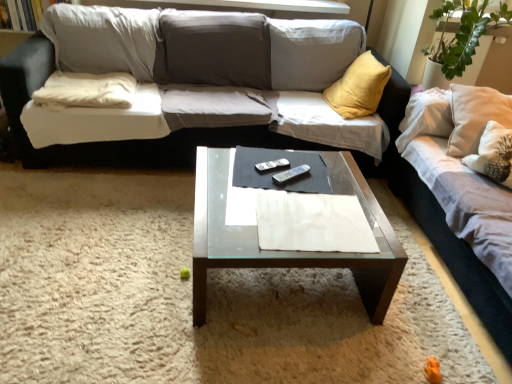
The image size is (512, 384). In order to click on vacant point to the right of silver metallic remote at center, marked as the 1th remote in a top-to-bottom arrangement in this screenshot , I will do `click(315, 171)`.